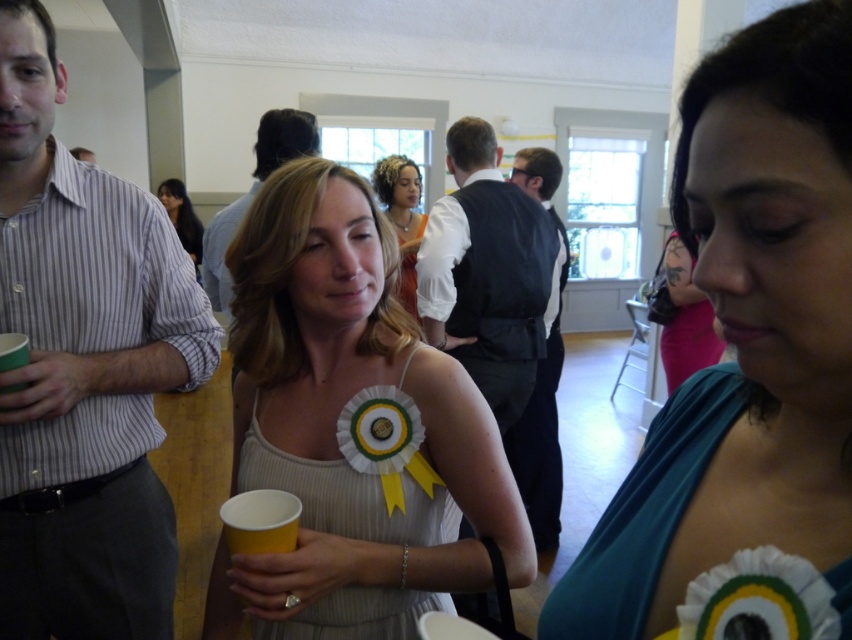
You are standing in the room and want to move from point A at point [686,320] to point B at point [272,134]. Which direction should you move to get closer to point B?

To move from point A at point [686,320] to point B at point [272,134], you should move towards the left and downward since point B is located to the left and lower in the image compared to point A.

You are standing in the room and want to reach the point marked as point (x=700, y=364). If you can walk 3 meters in 1 minute, how long will it take you to reach that point?

The distance between you and point (x=700, y=364) is 2.74 meters. Since you can walk 3 meters in 1 minute, it will take approximately 55 seconds to reach the point.